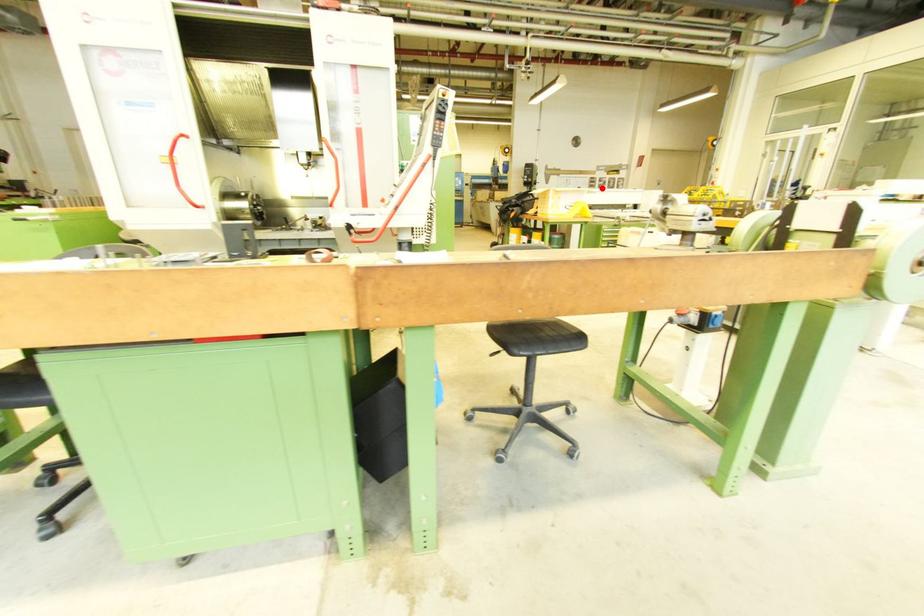
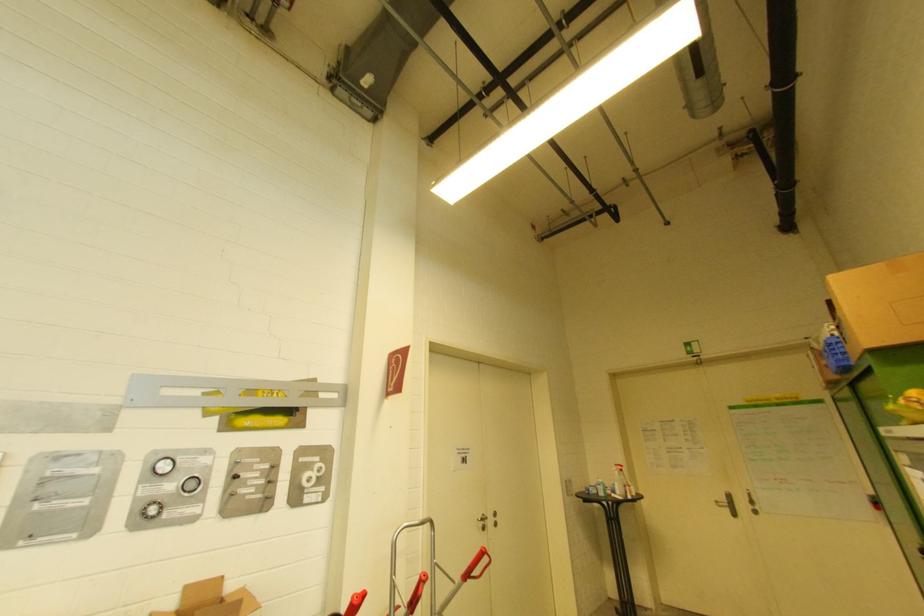
Locate, in the second image, the point that corresponds to the highlighted location in the first image.

(149, 517)